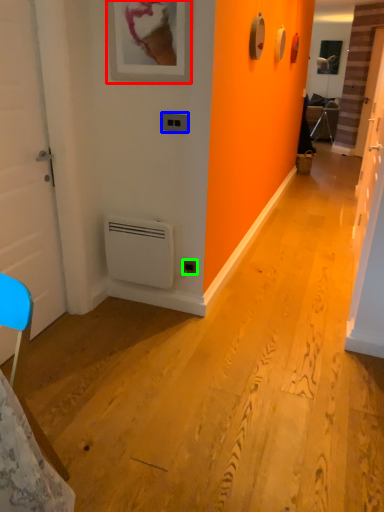
Question: Considering the real-world distances, which object is closest to picture frame (highlighted by a red box)? light switch (highlighted by a blue box) or electric outlet (highlighted by a green box).

Choices:
 (A) light switch
 (B) electric outlet

Answer: (A)